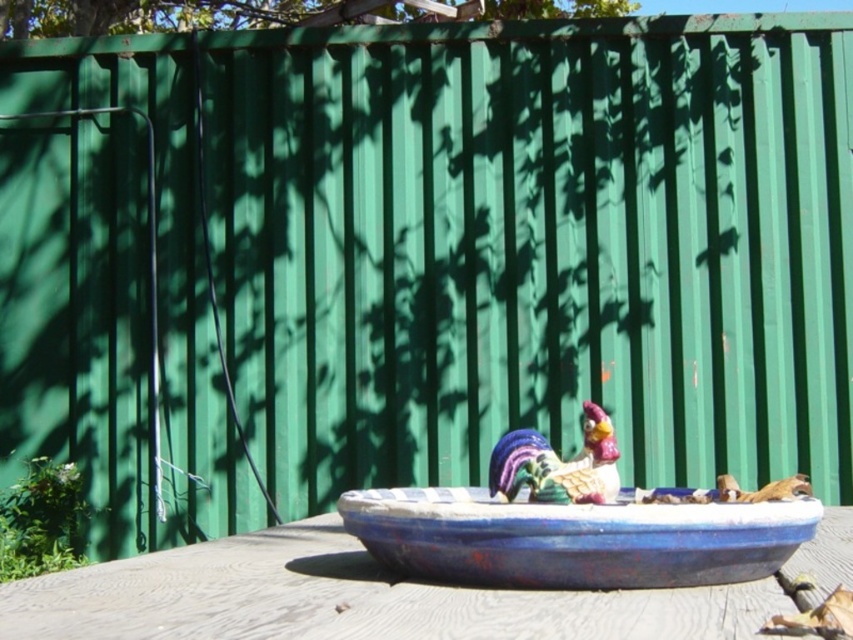
You are standing in the backyard and see the wooden table at center and the multicolored glazed ceramic rooster at center. Which object is positioned to the right side?

The wooden table at center is positioned to the right of the multicolored glazed ceramic rooster at center.

You are standing in the backyard scene described. If you were to walk directly towards the wooden table at center from the direction of the fence, would you approach it from the front or the back?

Since the wooden table at center is located at the foreground with the fence in the background, approaching from the direction of the fence would mean you are coming from behind the table. Therefore, you would be approaching its back side.